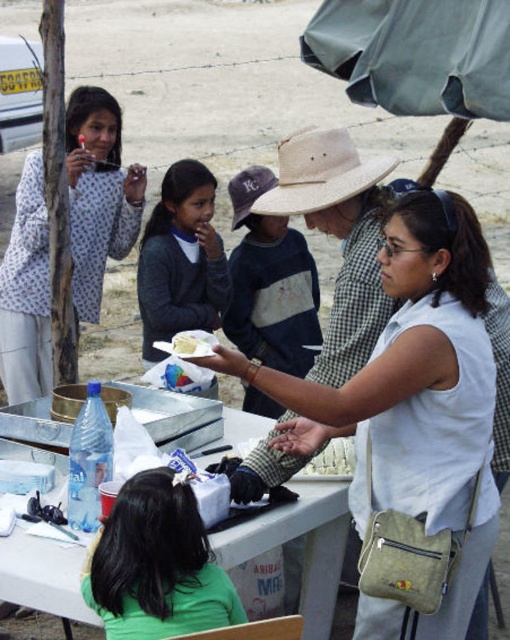
Question: In this image, where is dark blue cotton shirt at center located relative to yellow cake at center?

Choices:
 (A) left
 (B) right

Answer: (B)

Question: Does dark gray sweater at center appear under white crumbly cake at center?

Choices:
 (A) yes
 (B) no

Answer: (B)

Question: Which of the following is the closest to the observer?

Choices:
 (A) (12, 330)
 (B) (311, 470)
 (C) (389, 333)

Answer: (C)

Question: Among these points, which one is nearest to the camera?

Choices:
 (A) (288, 288)
 (B) (339, 470)

Answer: (B)

Question: From the image, what is the correct spatial relationship of floral fabric shirt at upper left in relation to dark gray sweater at center?

Choices:
 (A) below
 (B) above

Answer: (B)

Question: Among these points, which one is farthest from the camera?

Choices:
 (A) (30, 572)
 (B) (267, 352)
 (C) (31, 276)

Answer: (B)